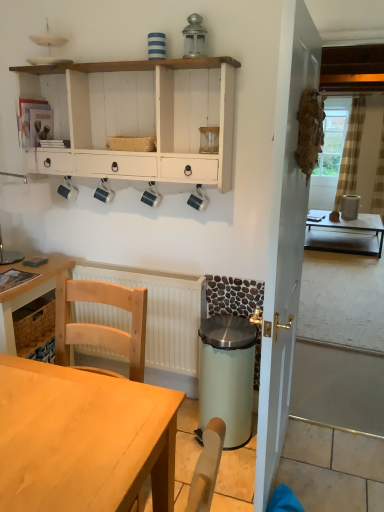
Question: From a real-world perspective, is light green plastic trash can at lower center physically located above or below clear glass window screen at upper right?

Choices:
 (A) above
 (B) below

Answer: (B)

Question: Looking at the image, does light green plastic trash can at lower center seem bigger or smaller compared to clear glass window screen at upper right?

Choices:
 (A) big
 (B) small

Answer: (A)

Question: Based on their relative distances, which object is nearer to the wooden desk at lower left, which ranks as the 2th desk in left-to-right order?

Choices:
 (A) white wood cabinet at upper center
 (B) wooden desk at left, which appears as the 2th desk when viewed from the front
 (C) matte black coffee cup at lower center, which is the 2th coffee cup in right-to-left order
 (D) light green plastic trash can at lower center
 (E) clear glass window screen at upper right

Answer: (B)

Question: Which of these objects is positioned closest to the clear glass window screen at upper right?

Choices:
 (A) white plastic radiator at lower center
 (B) matte black coffee cup at lower center, which is the 2th coffee cup in right-to-left order
 (C) white wood cabinet at upper center
 (D) matte black coffee cup at center, which is the 3th coffee cup from left to right
 (E) wooden desk at left, the 1th desk positioned from the left

Answer: (C)